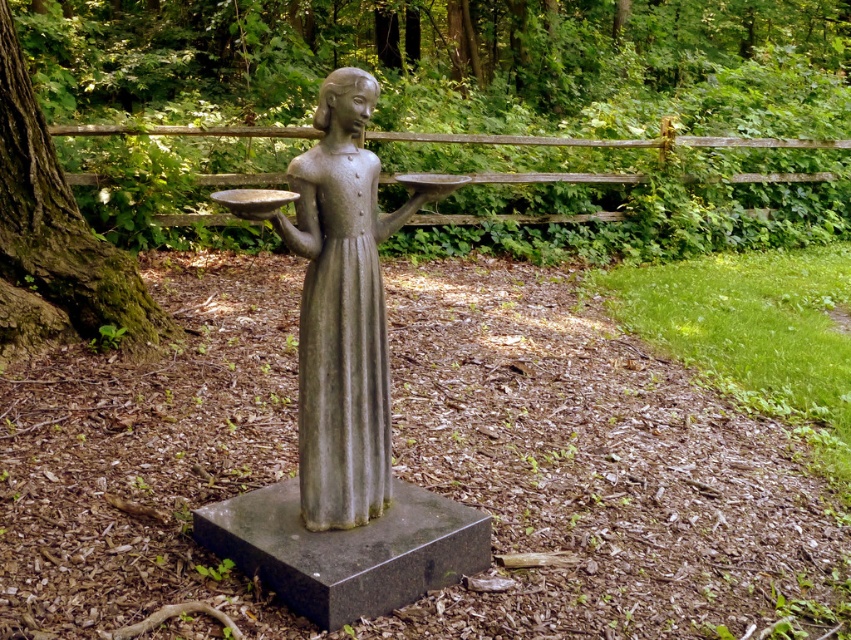
Question: Can you confirm if bronze statue at center is smaller than green mossy tree trunk at left?

Choices:
 (A) no
 (B) yes

Answer: (B)

Question: Which point is farther from the camera taking this photo?

Choices:
 (A) (357, 493)
 (B) (583, 10)

Answer: (B)

Question: Can you confirm if green mossy tree trunk at center-left is bigger than green mossy tree trunk at left?

Choices:
 (A) no
 (B) yes

Answer: (B)

Question: Which point is farther to the camera?

Choices:
 (A) bronze statue at center
 (B) green mossy tree trunk at center-left
 (C) green mossy tree trunk at left

Answer: (C)

Question: Is green mossy tree trunk at center-left positioned in front of bronze statue at center?

Choices:
 (A) yes
 (B) no

Answer: (B)

Question: Which point appears closest to the camera in this image?

Choices:
 (A) coord(63,182)
 (B) coord(626,81)

Answer: (A)